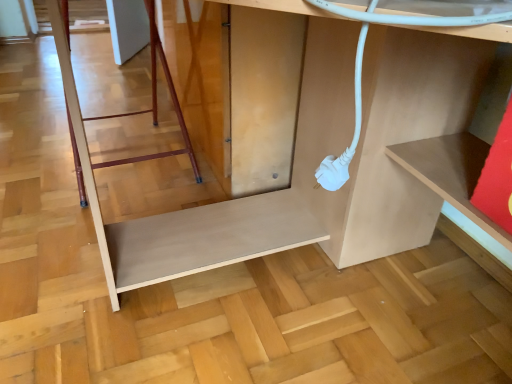
Question: Considering the positions of point (143, 0) and point (147, 228), is point (143, 0) closer or farther from the camera than point (147, 228)?

Choices:
 (A) closer
 (B) farther

Answer: (B)

Question: In terms of size, does wooden ladder at lower left appear bigger or smaller than matte white cable at lower center?

Choices:
 (A) big
 (B) small

Answer: (B)

Question: In the image, is wooden ladder at lower left on the left side or the right side of matte white cable at lower center?

Choices:
 (A) right
 (B) left

Answer: (B)

Question: Considering the relative positions of matte white cable at lower center and wooden ladder at lower left in the image provided, is matte white cable at lower center to the left or to the right of wooden ladder at lower left?

Choices:
 (A) left
 (B) right

Answer: (B)

Question: Does point tap(152, 246) appear closer or farther from the camera than point tap(177, 115)?

Choices:
 (A) farther
 (B) closer

Answer: (B)

Question: Considering the positions of matte white cable at lower center and wooden ladder at lower left in the image, is matte white cable at lower center wider or thinner than wooden ladder at lower left?

Choices:
 (A) wide
 (B) thin

Answer: (A)

Question: Considering the positions of matte white cable at lower center and wooden ladder at lower left in the image, is matte white cable at lower center taller or shorter than wooden ladder at lower left?

Choices:
 (A) short
 (B) tall

Answer: (B)